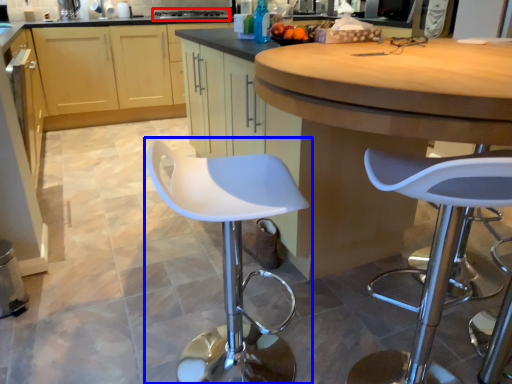
Question: Which of the following is the closest to the observer, stove (highlighted by a red box) or chair (highlighted by a blue box)?

Choices:
 (A) stove
 (B) chair

Answer: (B)